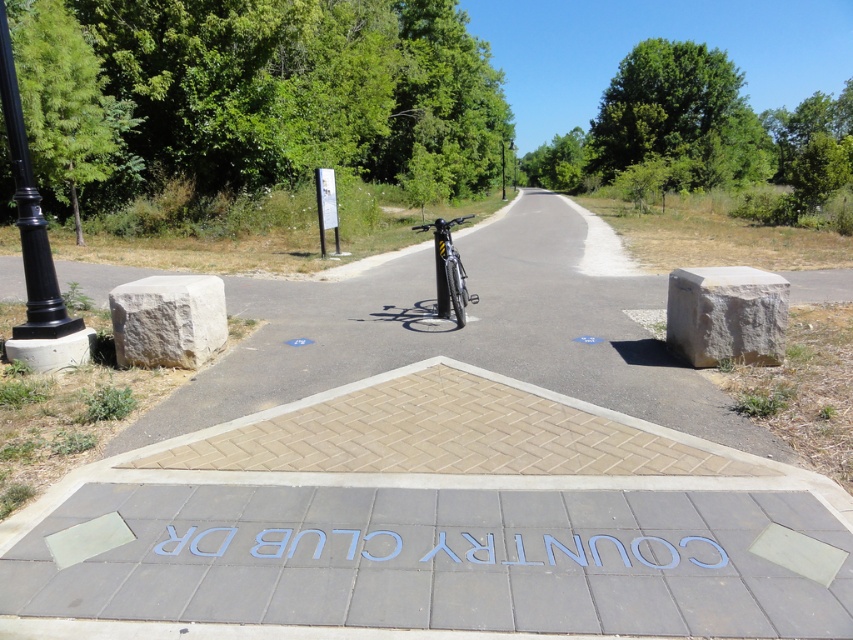
Question: Which point appears farthest from the camera in this image?

Choices:
 (A) (448, 307)
 (B) (503, 170)

Answer: (B)

Question: Does black polished metal pole at left appear under black metal lamp post at upper center?

Choices:
 (A) no
 (B) yes

Answer: (B)

Question: Where is black polished metal pole at left located in relation to shiny silver bicycle at center in the image?

Choices:
 (A) below
 (B) above

Answer: (A)

Question: Estimate the real-world distances between objects in this image. Which object is farther from the black polished metal pole at left?

Choices:
 (A) shiny silver bicycle at center
 (B) black metal lamp post at upper center

Answer: (B)

Question: Which point is farther to the camera?

Choices:
 (A) (18, 221)
 (B) (456, 307)

Answer: (B)

Question: Observing the image, what is the correct spatial positioning of black polished metal pole at left in reference to black metal lamp post at upper center?

Choices:
 (A) right
 (B) left

Answer: (B)